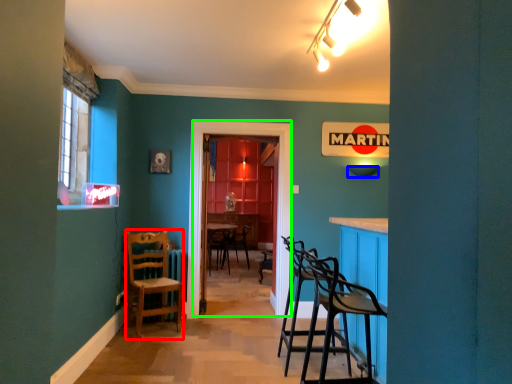
Question: Considering the real-world distances, which object is farthest from chair (highlighted by a red box)? lampshade (highlighted by a blue box) or glass door (highlighted by a green box)?

Choices:
 (A) lampshade
 (B) glass door

Answer: (A)